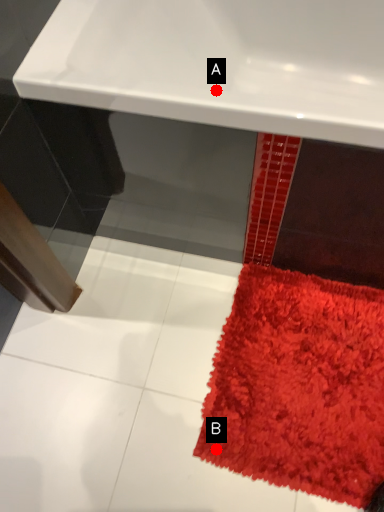
Question: Two points are circled on the image, labeled by A and B beside each circle. Among these points, which one is farthest from the camera?

Choices:
 (A) A is further
 (B) B is further

Answer: (B)